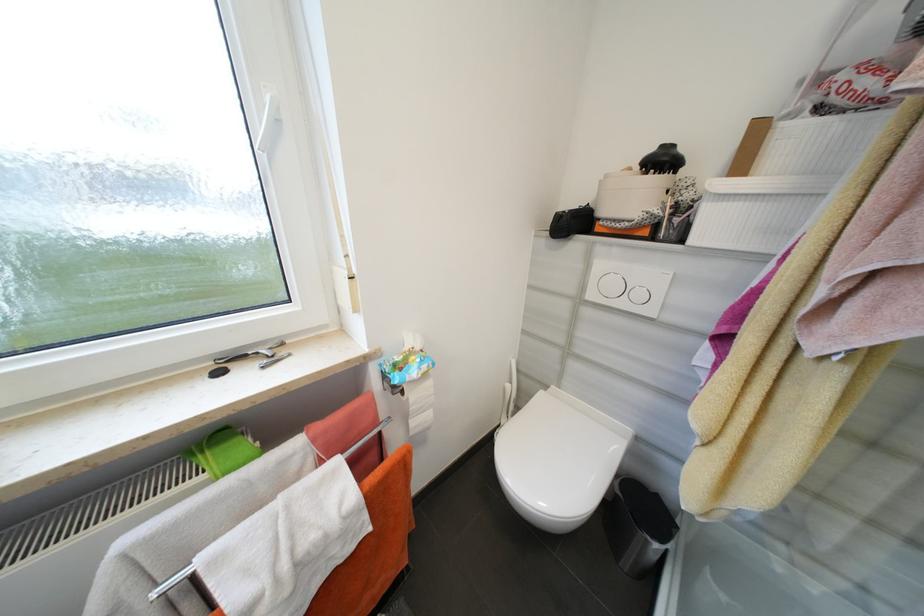
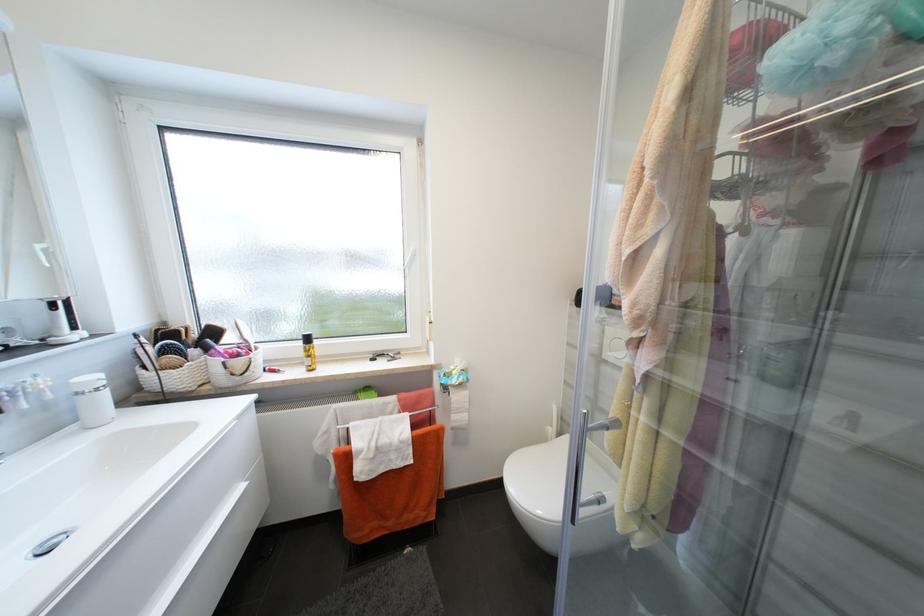
Question: The camera is either moving clockwise (left) or counter-clockwise (right) around the object. The first image is from the beginning of the video and the second image is from the end. Is the camera moving left or right when shooting the video?

Choices:
 (A) Left
 (B) Right

Answer: (B)